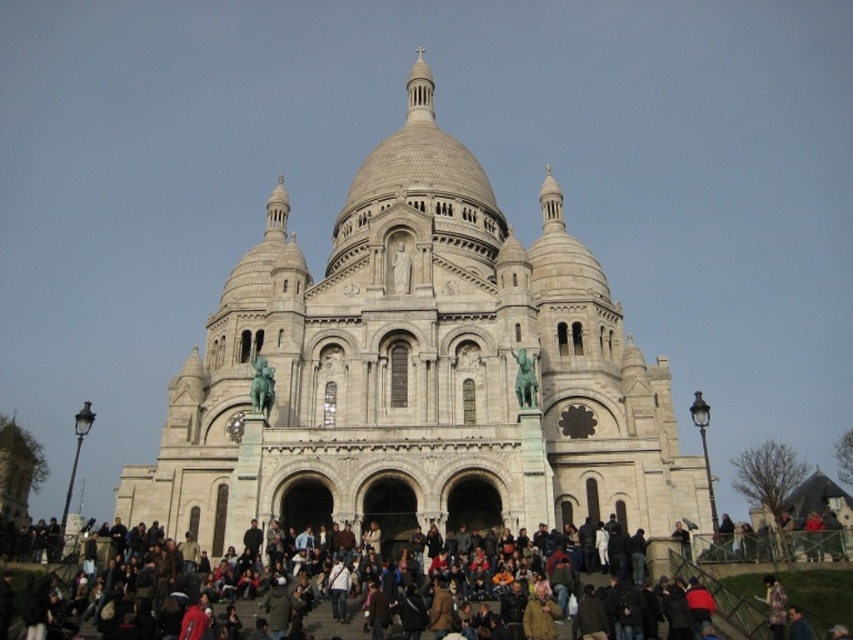
You are a tourist visiting the Basilica of the Sacred Heart of Paris. You notice the white stone church at center and the multicolored clothing at lower center in the scene. Which object takes up more space in the image?

The white stone church at center takes up more space in the image because it is bigger than the multicolored clothing at lower center.

You are a tourist standing at the base of Montmartre hill, looking up at the Basilica of the Sacred Heart of Paris. You notice the white stone church at center and the multicolored clothing at lower center. Which object is wider in this view?

The white stone church at center is wider than the multicolored clothing at lower center.

You are standing in front of the Basilica of the Sacred Heart of Paris. Where exactly is the white stone church at center located in terms of coordinates?

The white stone church at center is located at coordinates point (x=416, y=371).